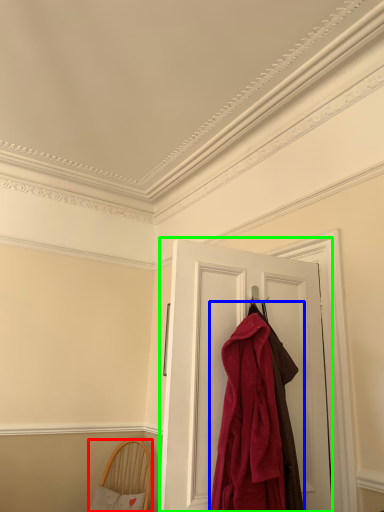
Question: Which object is the farthest from furniture (highlighted by a red box)? Choose among these: cloak (highlighted by a blue box) or door (highlighted by a green box).

Choices:
 (A) cloak
 (B) door

Answer: (A)